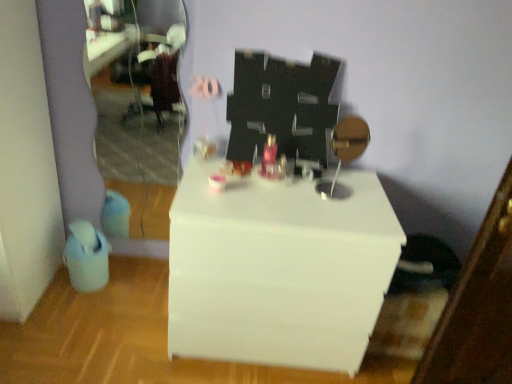
Image resolution: width=512 pixels, height=384 pixels. Identify the location of clear glass mirror at left. click(x=139, y=101).

Measure the distance between clear glass mirror at left and camera.

The depth of clear glass mirror at left is 8.33 feet.

What do you see at coordinates (139, 101) in the screenshot?
I see `clear glass mirror at left` at bounding box center [139, 101].

Based on the photo, measure the distance between white glossy table at center and camera.

The depth of white glossy table at center is 1.42 meters.

You are a GUI agent. You are given a task and a screenshot of the screen. Output one action in this format:
    pyautogui.click(x=<x>, y=<y>)
    Task: Click on the white glossy table at center
    The height and width of the screenshot is (384, 512).
    Given the screenshot: What is the action you would take?
    pyautogui.click(x=279, y=268)

The image size is (512, 384). What do you see at coordinates (279, 268) in the screenshot?
I see `white glossy table at center` at bounding box center [279, 268].

Locate an element on the screen. This screenshot has width=512, height=384. clear glass mirror at left is located at coordinates (139, 101).

Between white glossy table at center and clear glass mirror at left, which one appears on the left side from the viewer's perspective?

From the viewer's perspective, clear glass mirror at left appears more on the left side.

Considering the relative positions of white glossy table at center and clear glass mirror at left in the image provided, is white glossy table at center in front of clear glass mirror at left?

Yes, it is in front of clear glass mirror at left.

Is point (361, 345) more distant than point (167, 97)?

That is False.

From the image's perspective, is white glossy table at center on top of clear glass mirror at left?

No.

From a real-world perspective, is white glossy table at center located higher than clear glass mirror at left?

Actually, white glossy table at center is physically below clear glass mirror at left in the real world.

Which object is thinner, white glossy table at center or clear glass mirror at left?

Thinner between the two is clear glass mirror at left.

Considering the relative sizes of white glossy table at center and clear glass mirror at left in the image provided, is white glossy table at center shorter than clear glass mirror at left?

Correct, white glossy table at center is not as tall as clear glass mirror at left.

Based on the photo, considering the relative sizes of white glossy table at center and clear glass mirror at left in the image provided, is white glossy table at center smaller than clear glass mirror at left?

No, white glossy table at center is not smaller than clear glass mirror at left.

Is clear glass mirror at left completely or partially inside white glossy table at center?

No, white glossy table at center does not contain clear glass mirror at left.

Is white glossy table at center not close to clear glass mirror at left?

Yes, white glossy table at center is far from clear glass mirror at left.

Is white glossy table at center aimed at clear glass mirror at left?

No, white glossy table at center is not oriented towards clear glass mirror at left.

How many degrees apart are the facing directions of white glossy table at center and clear glass mirror at left?

2.07 degrees.

Locate an element on the screen. The image size is (512, 384). table in front of the clear glass mirror at left is located at coordinates (279, 268).

Can you confirm if clear glass mirror at left is positioned to the right of white glossy table at center?

In fact, clear glass mirror at left is to the left of white glossy table at center.

Considering the relative positions of clear glass mirror at left and white glossy table at center in the image provided, is clear glass mirror at left in front of white glossy table at center?

No, it is behind white glossy table at center.

Which is closer to the camera, (x=183, y=18) or (x=225, y=276)?

Point (x=183, y=18).

Consider the image. From the image's perspective, which is above, clear glass mirror at left or white glossy table at center?

From the image's view, clear glass mirror at left is above.

From a real-world perspective, who is located lower, clear glass mirror at left or white glossy table at center?

In real-world perspective, white glossy table at center is lower.

Can you confirm if clear glass mirror at left is thinner than white glossy table at center?

Correct, the width of clear glass mirror at left is less than that of white glossy table at center.

Is clear glass mirror at left shorter than white glossy table at center?

Incorrect, the height of clear glass mirror at left does not fall short of that of white glossy table at center.

Considering the relative sizes of clear glass mirror at left and white glossy table at center in the image provided, is clear glass mirror at left smaller than white glossy table at center?

Yes, clear glass mirror at left is smaller than white glossy table at center.

From the picture: Is white glossy table at center completely or partially inside clear glass mirror at left?

No, white glossy table at center is not inside clear glass mirror at left.

Is clear glass mirror at left beside white glossy table at center?

No, clear glass mirror at left is not with white glossy table at center.

Is clear glass mirror at left positioned with its back to white glossy table at center?

No.

What's the angular difference between clear glass mirror at left and white glossy table at center's facing directions?

2.07 degrees.

The width and height of the screenshot is (512, 384). What are the coordinates of `mirror that is on the left side of white glossy table at center` in the screenshot? It's located at (139, 101).

This screenshot has width=512, height=384. Find the location of `table below the clear glass mirror at left (from a real-world perspective)`. table below the clear glass mirror at left (from a real-world perspective) is located at coordinates (279, 268).

In order to click on mirror above the white glossy table at center (from a real-world perspective) in this screenshot , I will do `click(139, 101)`.